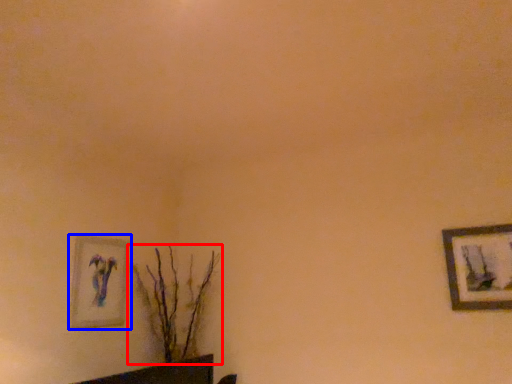
Question: Which point is further to the camera, houseplant (highlighted by a red box) or picture frame (highlighted by a blue box)?

Choices:
 (A) houseplant
 (B) picture frame

Answer: (A)